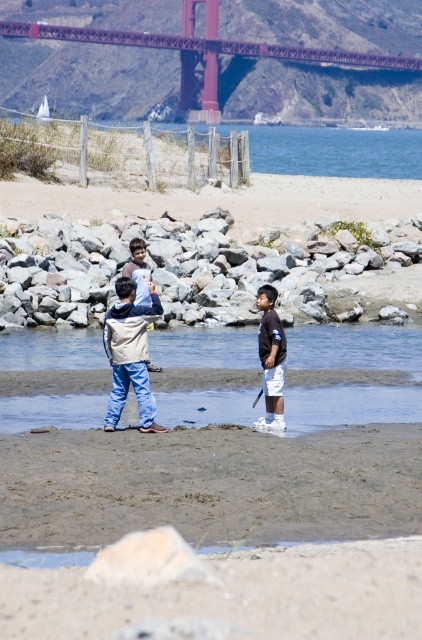
You are a photographer trying to capture a shot of the Golden Gate Bridge with both the white sand at lower center and the light brown cotton shirt at center in the frame. Based on their positions, which object should you focus on first to ensure both are in the frame?

The light brown cotton shirt at center is above the white sand at lower center, so you should focus on the light brown cotton shirt at center first to ensure both are in the frame.

You are a photographer trying to capture a photo of the Golden Gate Bridge with the beach in the foreground. You notice the white sand at lower center and the light blue denim pants at center. Which object is closer to the camera?

The light blue denim pants at center are closer to the camera than the white sand at lower center because the white sand at lower center is positioned below it, indicating it is further away.